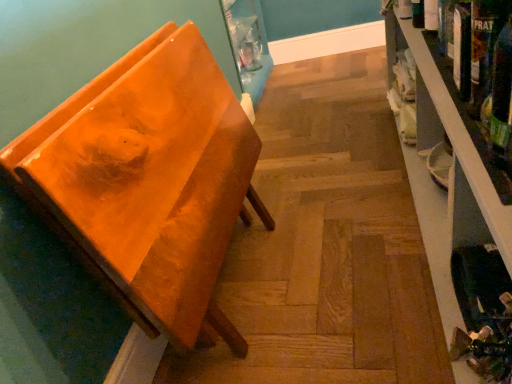
Question: Considering the relative positions of orange glossy chair at left and green glass bottle at right in the image provided, is orange glossy chair at left behind green glass bottle at right?

Choices:
 (A) no
 (B) yes

Answer: (B)

Question: From a real-world perspective, is orange glossy chair at left on top of green glass bottle at right?

Choices:
 (A) no
 (B) yes

Answer: (A)

Question: Can you confirm if orange glossy chair at left is shorter than green glass bottle at right?

Choices:
 (A) no
 (B) yes

Answer: (A)

Question: Is orange glossy chair at left taller than green glass bottle at right?

Choices:
 (A) yes
 (B) no

Answer: (A)

Question: From the image's perspective, is orange glossy chair at left located beneath green glass bottle at right?

Choices:
 (A) yes
 (B) no

Answer: (A)

Question: Considering the relative sizes of orange glossy chair at left and green glass bottle at right in the image provided, is orange glossy chair at left thinner than green glass bottle at right?

Choices:
 (A) yes
 (B) no

Answer: (B)

Question: From the image's perspective, is green glass bottle at right on wooden shelf at right?

Choices:
 (A) no
 (B) yes

Answer: (A)

Question: Are green glass bottle at right and wooden shelf at right located far from each other?

Choices:
 (A) no
 (B) yes

Answer: (A)

Question: Does green glass bottle at right lie behind wooden shelf at right?

Choices:
 (A) yes
 (B) no

Answer: (A)

Question: From a real-world perspective, is green glass bottle at right over wooden shelf at right?

Choices:
 (A) no
 (B) yes

Answer: (B)

Question: Can you confirm if green glass bottle at right is shorter than wooden shelf at right?

Choices:
 (A) yes
 (B) no

Answer: (A)

Question: Does green glass bottle at right have a lesser width compared to wooden shelf at right?

Choices:
 (A) yes
 (B) no

Answer: (A)

Question: Considering the relative sizes of wooden shelf at right and green glass bottle at right in the image provided, is wooden shelf at right thinner than green glass bottle at right?

Choices:
 (A) no
 (B) yes

Answer: (A)